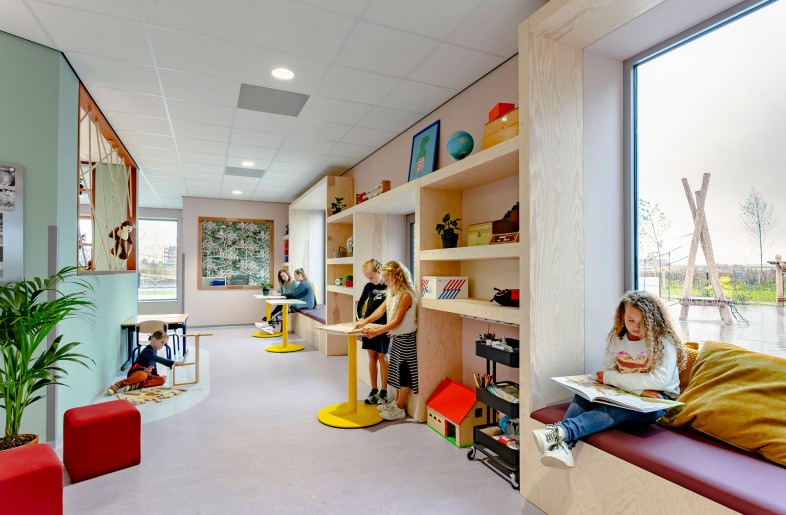
Where is `chair`? Image resolution: width=786 pixels, height=515 pixels. chair is located at coordinates (97, 443).